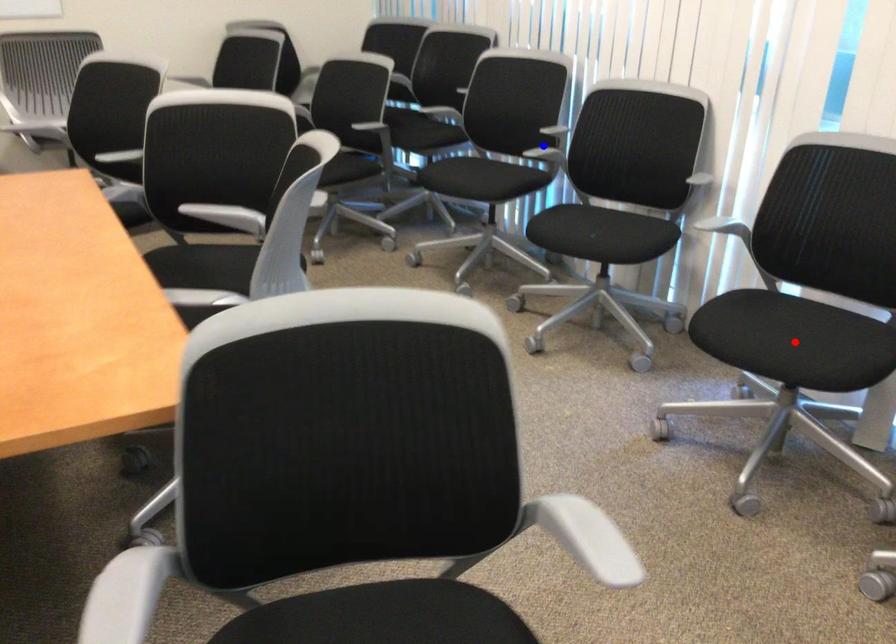
Question: Two points are marked on the image. Which point is closer to the camera?

Choices:
 (A) Blue point is closer.
 (B) Red point is closer.

Answer: (B)